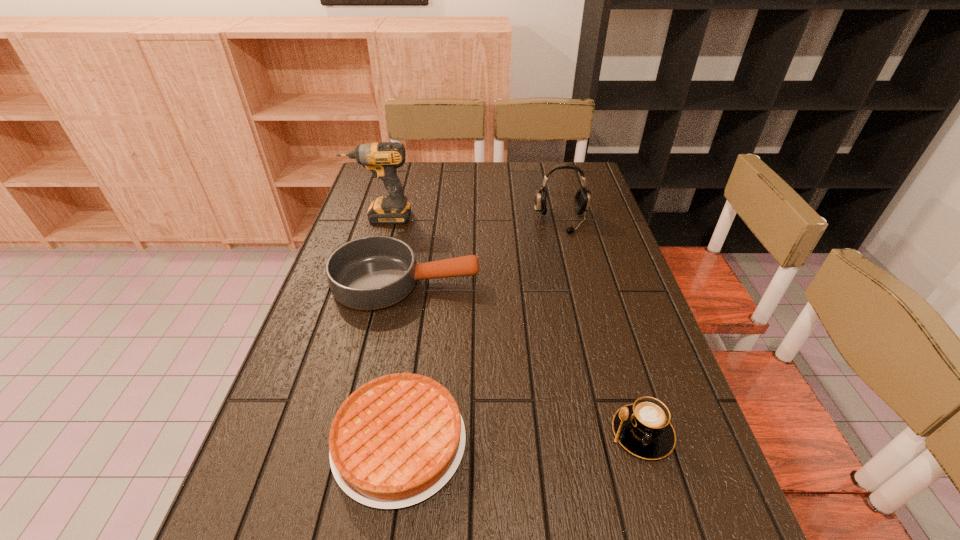
The image size is (960, 540). Identify the location of vacant position in the image that satisfies the following two spatial constraints: 1. with the drill bit of the pie facing forward; 2. on the right side of the drill. (312, 442).

Where is `free spot that satisfies the following two spatial constraints: 1. on the handle side of the cappuccino; 2. on the left side of the pan`? This screenshot has width=960, height=540. free spot that satisfies the following two spatial constraints: 1. on the handle side of the cappuccino; 2. on the left side of the pan is located at coordinates [377, 433].

Locate an element on the screen. Image resolution: width=960 pixels, height=540 pixels. free point that satisfies the following two spatial constraints: 1. with the drill bit of the drill facing forward; 2. on the back side of the pie is located at coordinates (312, 442).

Find the location of a particular element. free region that satisfies the following two spatial constraints: 1. on the back side of the pie; 2. on the handle side of the third nearest object is located at coordinates (422, 283).

Identify the location of vacant space that satisfies the following two spatial constraints: 1. on the handle side of the third farthest object; 2. on the right side of the pie. Image resolution: width=960 pixels, height=540 pixels. (376, 442).

Locate an element on the screen. The image size is (960, 540). vacant region that satisfies the following two spatial constraints: 1. with the microphone on the side of the cappuccino; 2. on the left side of the second tallest object is located at coordinates (614, 433).

This screenshot has height=540, width=960. Identify the location of vacant space that satisfies the following two spatial constraints: 1. with the drill bit of the drill facing forward; 2. on the left side of the shortest object. point(312,442).

Identify the location of vacant area in the image that satisfies the following two spatial constraints: 1. with the drill bit of the drill facing forward; 2. on the left side of the cappuccino. The image size is (960, 540). (315, 433).

At what (x,y) coordinates should I click in order to perform the action: click on vacant area in the image that satisfies the following two spatial constraints: 1. with the microphone on the side of the headset; 2. on the handle side of the third nearest object. Please return your answer as a coordinate pair (x, y). Looking at the image, I should click on (577, 283).